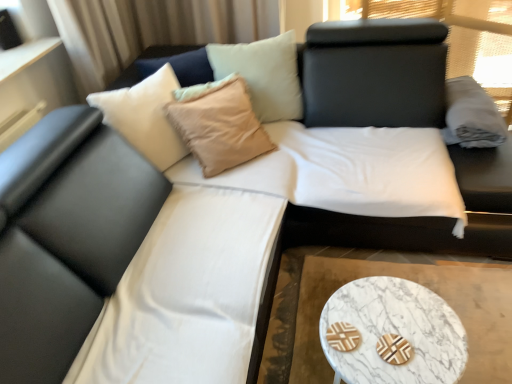
At what (x,y) coordinates should I click in order to perform the action: click on vacant region above marble/stone coffee table at lower right (from a real-world perspective). Please return your answer as a coordinate pair (x, y). This screenshot has width=512, height=384. Looking at the image, I should click on (392, 332).